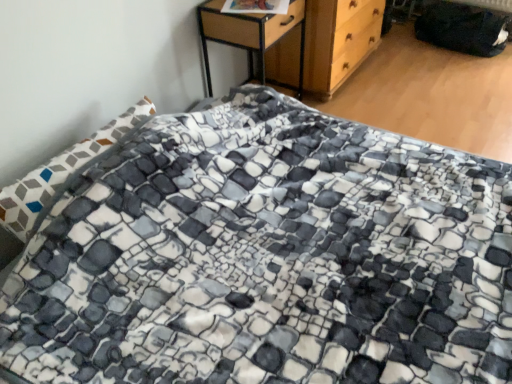
Question: Is wooden chest of drawers at upper center to the left or to the right of woodenmaterial/texturenightstand at upper center in the image?

Choices:
 (A) right
 (B) left

Answer: (A)

Question: From a real-world perspective, relative to woodenmaterial/texturenightstand at upper center, is wooden chest of drawers at upper center vertically above or below?

Choices:
 (A) below
 (B) above

Answer: (A)

Question: Does point (313, 29) appear closer or farther from the camera than point (295, 6)?

Choices:
 (A) closer
 (B) farther

Answer: (B)

Question: In the image, is woodenmaterial/texturenightstand at upper center positioned in front of or behind wooden chest of drawers at upper center?

Choices:
 (A) behind
 (B) front

Answer: (B)

Question: Do you think woodenmaterial/texturenightstand at upper center is within wooden chest of drawers at upper center, or outside of it?

Choices:
 (A) outside
 (B) inside

Answer: (A)

Question: Considering the relative positions of woodenmaterial/texturenightstand at upper center and wooden chest of drawers at upper center in the image provided, is woodenmaterial/texturenightstand at upper center to the left or to the right of wooden chest of drawers at upper center?

Choices:
 (A) left
 (B) right

Answer: (A)

Question: Considering the positions of woodenmaterial/texturenightstand at upper center and wooden chest of drawers at upper center in the image, is woodenmaterial/texturenightstand at upper center taller or shorter than wooden chest of drawers at upper center?

Choices:
 (A) short
 (B) tall

Answer: (B)